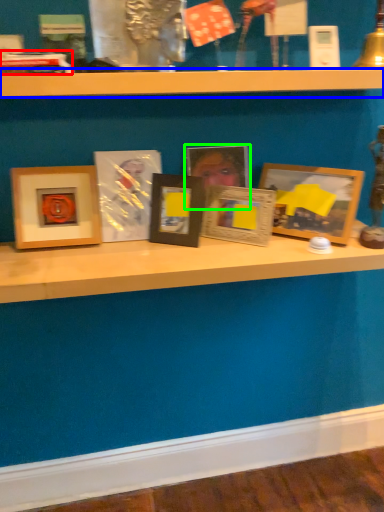
Question: Which is nearer to the book (highlighted by a red box)? shelf (highlighted by a blue box) or picture frame (highlighted by a green box).

Choices:
 (A) shelf
 (B) picture frame

Answer: (A)